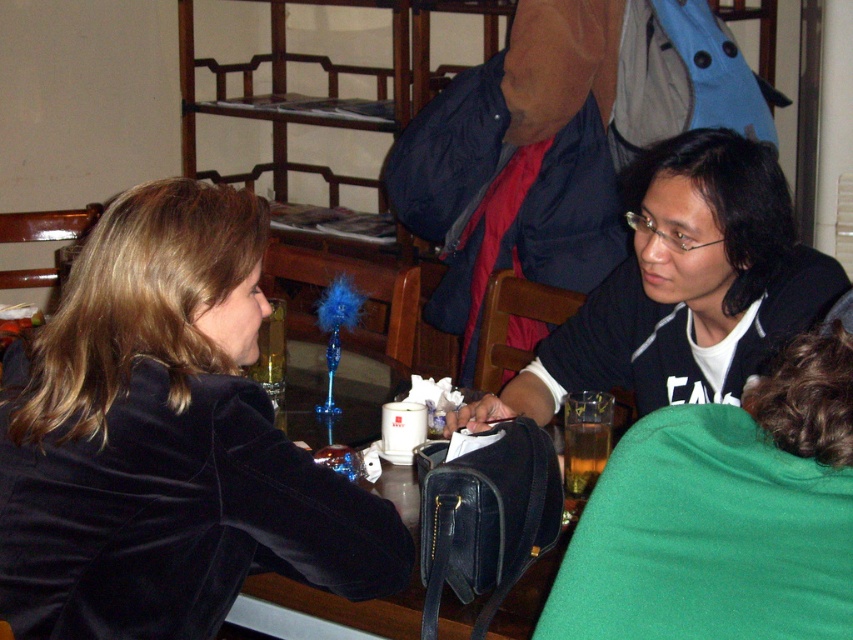
You are a tailor measuring the distance between two jackets to place them on a rack. The velvet black jacket at left and the black matte jacket at center are both on a table. If your rack can only fit items spaced 24 inches apart, will they fit together?

The velvet black jacket at left and the black matte jacket at center are 24.39 inches apart from each other. Since the required spacing is 24 inches, they will not fit together on the rack as the distance exceeds the rack capacity.

You are a photographer standing in front of the scene. You want to take a closeup shot of the velvet black jacket at left without moving any objects. Can you get within 1 meter to take the photo?

The velvet black jacket at left is currently 1.10 meters away from the viewer. Since you need to get within 1 meter, you can move closer by 0.10 meters to achieve the desired distance for the closeup shot.